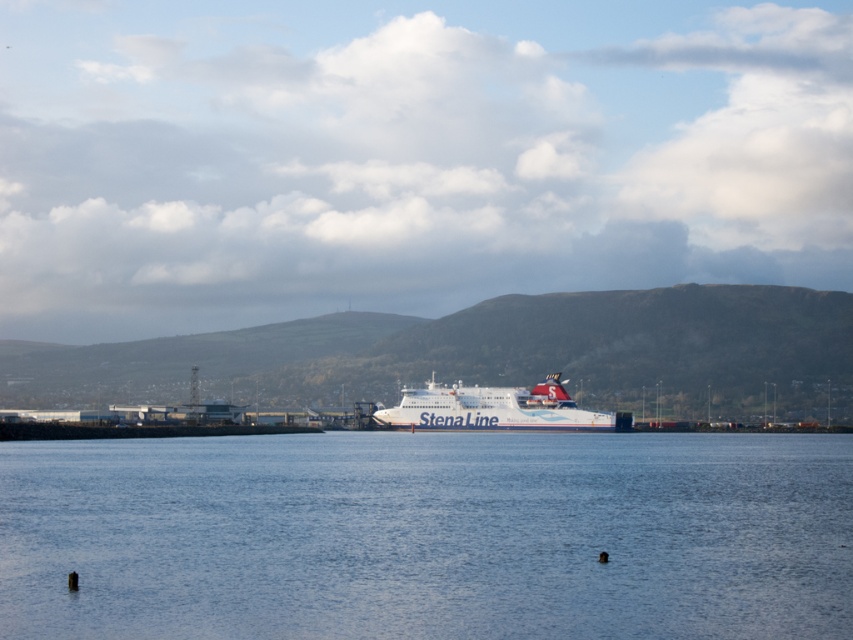
Question: Can you confirm if blue water at center is positioned to the right of white matte ferry at center?

Choices:
 (A) no
 (B) yes

Answer: (A)

Question: Among these points, which one is farthest from the camera?

Choices:
 (A) 495,410
 (B) 421,452

Answer: (A)

Question: Considering the relative positions of blue water at center and white matte ferry at center in the image provided, where is blue water at center located with respect to white matte ferry at center?

Choices:
 (A) below
 (B) above

Answer: (B)

Question: Is blue water at center smaller than white matte ferry at center?

Choices:
 (A) yes
 (B) no

Answer: (B)

Question: Which point appears farthest from the camera in this image?

Choices:
 (A) (399, 419)
 (B) (813, 560)

Answer: (A)